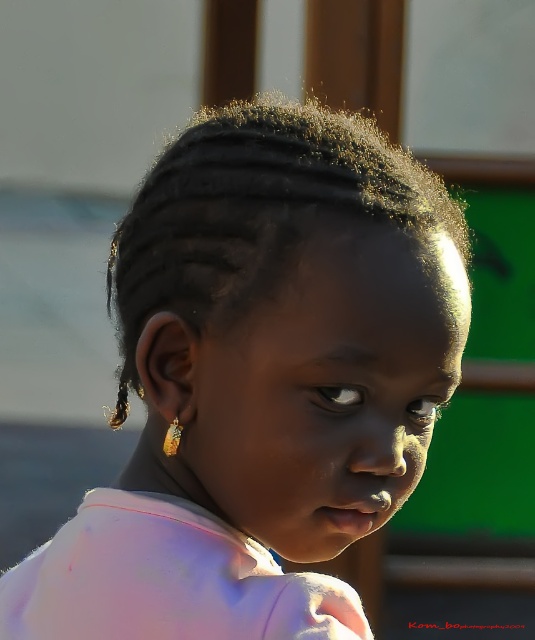
Question: Is dark brown textured hair at center wider than black glossy hair at left?

Choices:
 (A) yes
 (B) no

Answer: (A)

Question: Can you confirm if dark brown textured hair at center is positioned below black glossy hair at left?

Choices:
 (A) yes
 (B) no

Answer: (B)

Question: Among these objects, which one is nearest to the camera?

Choices:
 (A) dark brown textured hair at center
 (B) black glossy hair at left

Answer: (A)

Question: Does dark brown textured hair at center appear under black glossy hair at left?

Choices:
 (A) yes
 (B) no

Answer: (B)